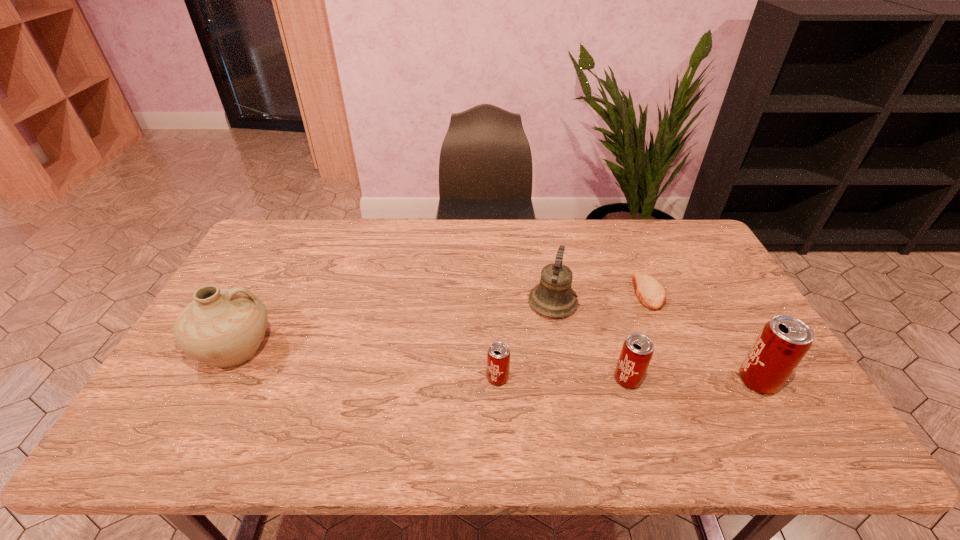
The width and height of the screenshot is (960, 540). Find the location of `blank area at the near edge`. blank area at the near edge is located at coordinates (301, 407).

At what (x,y) coordinates should I click in order to perform the action: click on vacant position at the right edge of the desktop. Please return your answer as a coordinate pair (x, y). The height and width of the screenshot is (540, 960). Looking at the image, I should click on (747, 308).

At what (x,y) coordinates should I click in order to perform the action: click on vacant area at the far left corner. Please return your answer as a coordinate pair (x, y). This screenshot has height=540, width=960. Looking at the image, I should click on (283, 250).

Identify the location of blank space at the near left corner of the desktop. (154, 408).

The width and height of the screenshot is (960, 540). Identify the location of blank space at the far right corner of the desktop. (661, 228).

Where is `free space between the shortest beer can and the pottery`? The width and height of the screenshot is (960, 540). free space between the shortest beer can and the pottery is located at coordinates (367, 363).

I want to click on vacant area that lies between the tallest beer can and the second tallest beer can, so click(693, 380).

Image resolution: width=960 pixels, height=540 pixels. I want to click on free space between the third object from left to right and the second beer can from left to right, so click(590, 341).

You are a GUI agent. You are given a task and a screenshot of the screen. Output one action in this format:
    pyautogui.click(x=<x>, y=<y>)
    Task: Click on the unoccupied area between the bell and the third shortest object
    The height and width of the screenshot is (540, 960).
    Given the screenshot: What is the action you would take?
    pyautogui.click(x=590, y=341)

At what (x,y) coordinates should I click in order to perform the action: click on vacant area between the tallest beer can and the third object from left to right. Please return your answer as a coordinate pair (x, y). The height and width of the screenshot is (540, 960). Looking at the image, I should click on (656, 342).